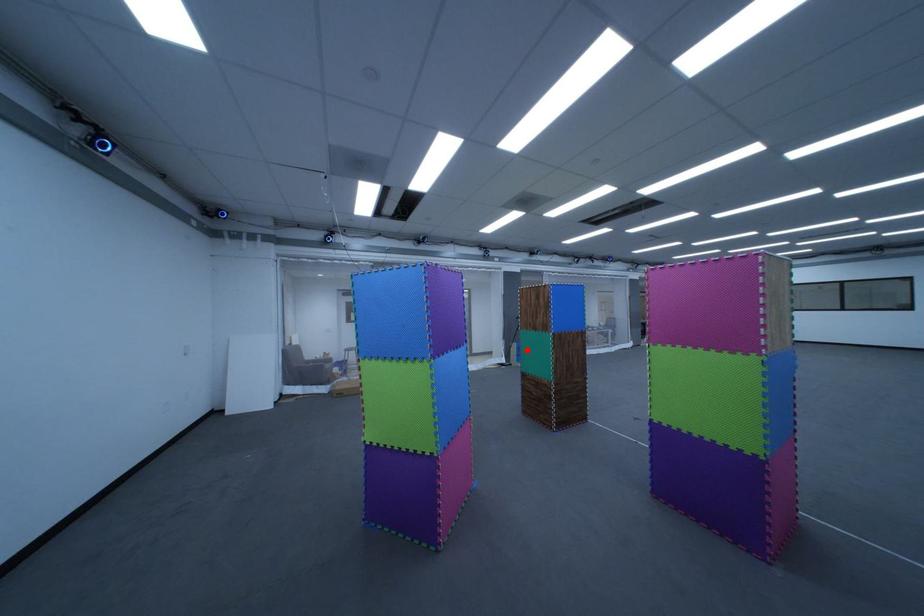
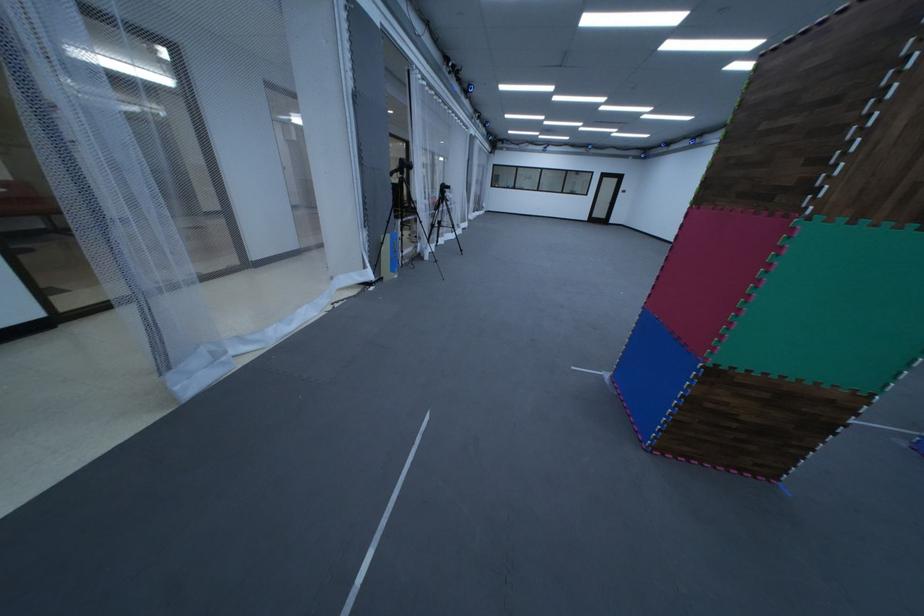
The point at the highlighted location is marked in the first image. Where is the corresponding point in the second image?

(398, 249)